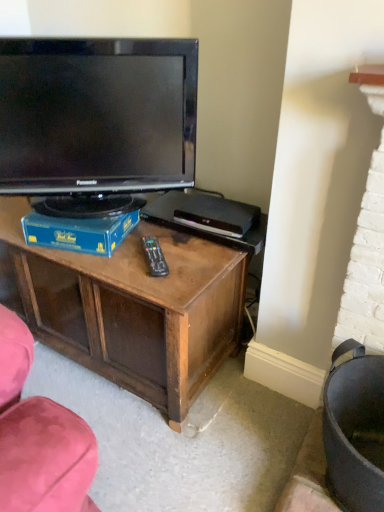
Question: Considering the relative sizes of blue cardboard box at center and black plastic remote at center in the image provided, is blue cardboard box at center thinner than black plastic remote at center?

Choices:
 (A) no
 (B) yes

Answer: (A)

Question: Is blue cardboard box at center facing towards black plastic remote at center?

Choices:
 (A) yes
 (B) no

Answer: (B)

Question: Is blue cardboard box at center positioned in front of black plastic remote at center?

Choices:
 (A) yes
 (B) no

Answer: (B)

Question: Can you confirm if blue cardboard box at center is positioned to the left of black plastic remote at center?

Choices:
 (A) no
 (B) yes

Answer: (B)

Question: Does blue cardboard box at center have a greater width compared to black plastic remote at center?

Choices:
 (A) yes
 (B) no

Answer: (A)

Question: Visually, is black plastic remote at center positioned to the left or to the right of black glossy television at upper left?

Choices:
 (A) left
 (B) right

Answer: (B)

Question: Considering the positions of black plastic remote at center and black glossy television at upper left in the image, is black plastic remote at center wider or thinner than black glossy television at upper left?

Choices:
 (A) thin
 (B) wide

Answer: (B)

Question: From the image's perspective, is black plastic remote at center above or below black glossy television at upper left?

Choices:
 (A) below
 (B) above

Answer: (A)

Question: Relative to black glossy television at upper left, is black plastic remote at center in front or behind?

Choices:
 (A) behind
 (B) front

Answer: (A)

Question: Looking at their shapes, would you say black plastic remote at center is wider or thinner than blue cardboard box at center?

Choices:
 (A) thin
 (B) wide

Answer: (A)

Question: Is black plastic remote at center bigger or smaller than blue cardboard box at center?

Choices:
 (A) small
 (B) big

Answer: (A)

Question: Does point (160, 254) appear closer or farther from the camera than point (36, 227)?

Choices:
 (A) closer
 (B) farther

Answer: (A)

Question: In terms of height, does black plastic remote at center look taller or shorter compared to blue cardboard box at center?

Choices:
 (A) tall
 (B) short

Answer: (B)

Question: Is point (125, 234) closer or farther from the camera than point (158, 69)?

Choices:
 (A) farther
 (B) closer

Answer: (A)

Question: From the image's perspective, is blue cardboard box at center above or below black glossy television at upper left?

Choices:
 (A) below
 (B) above

Answer: (A)